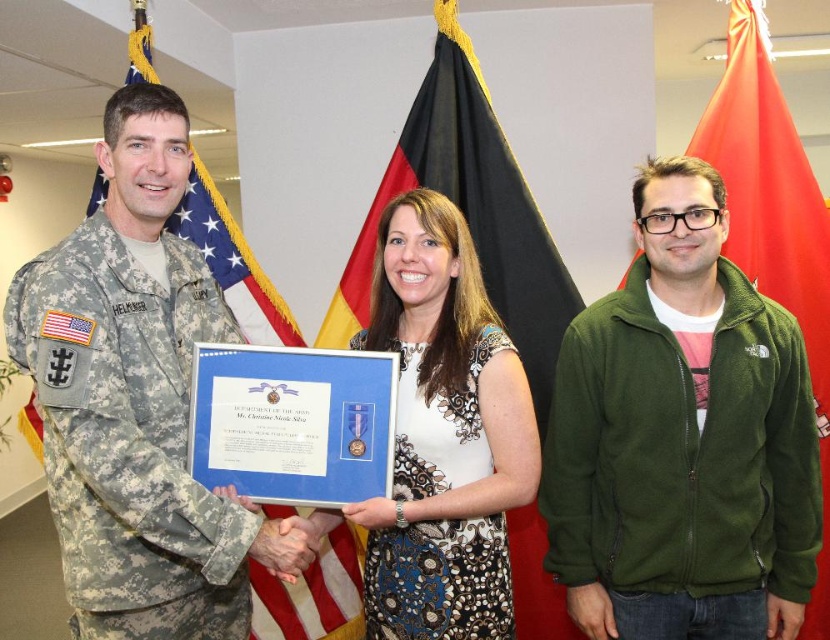
Consider the image. What are the coordinates of the black fabric flag at center?

The black fabric flag at center is located at coordinates (470, 205).